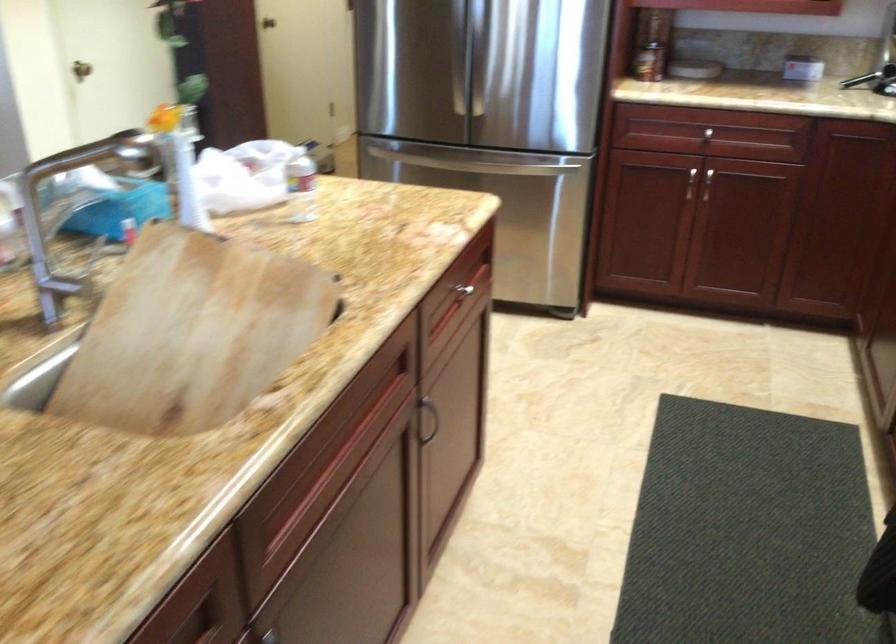
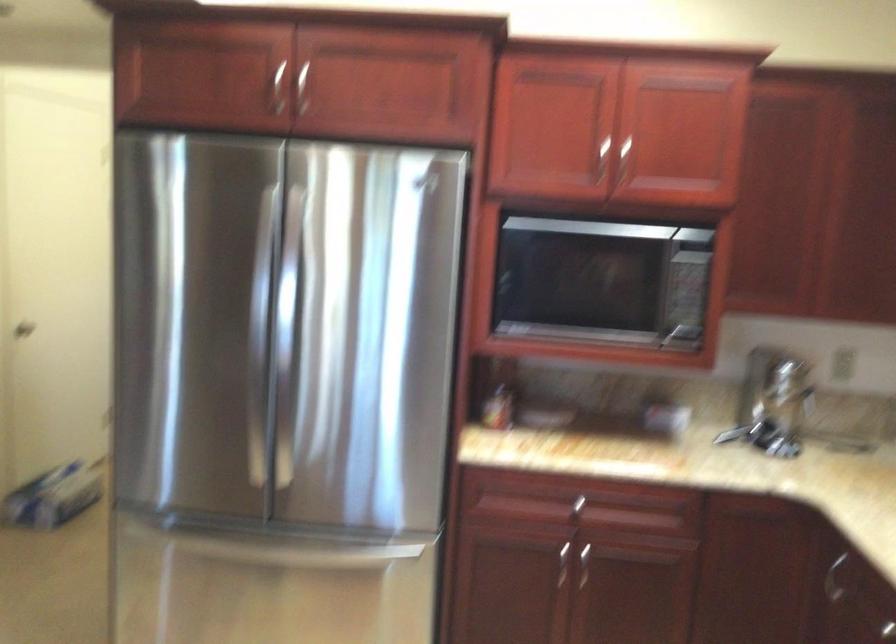
Question: Based on the continuous images, in which direction is the camera rotating? Reply with the corresponding letter.

Choices:
 (A) Left
 (B) Right
 (C) Up
 (D) Down

Answer: (C)